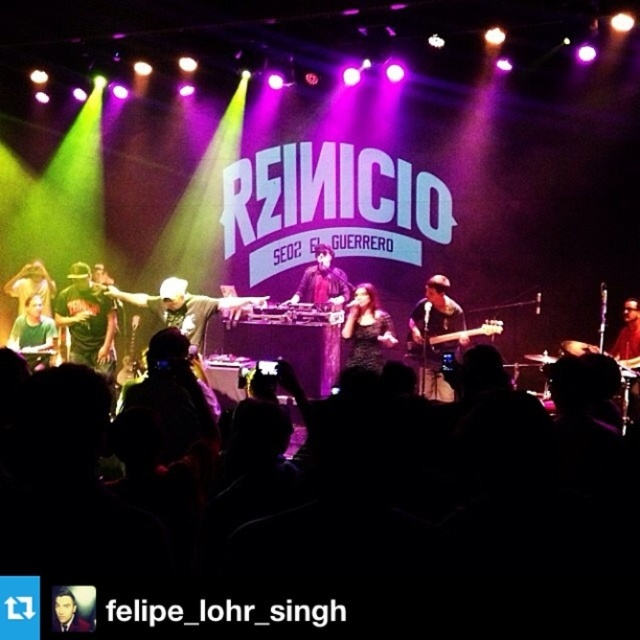
Question: Among these objects, which one is nearest to the camera?

Choices:
 (A) wooden electric guitar at center
 (B) matte black guitar at center

Answer: (B)

Question: Which point appears closest to the camera in this image?

Choices:
 (A) (460, 332)
 (B) (58, 324)
 (C) (372, 356)

Answer: (A)

Question: Does shiny black guitar at center appear on the left side of green matte shirt at left?

Choices:
 (A) yes
 (B) no

Answer: (B)

Question: Considering the real-world distances, which object is farthest from the green matte shirt at left?

Choices:
 (A) matte black dj booth at center
 (B) white cotton shirt at center
 (C) dark green shirt at center

Answer: (A)

Question: Can you confirm if matte black dj booth at center is smaller than black matte turntable at center?

Choices:
 (A) no
 (B) yes

Answer: (A)

Question: Does dark green shirt at center appear on the right side of shiny black guitar at center?

Choices:
 (A) no
 (B) yes

Answer: (A)